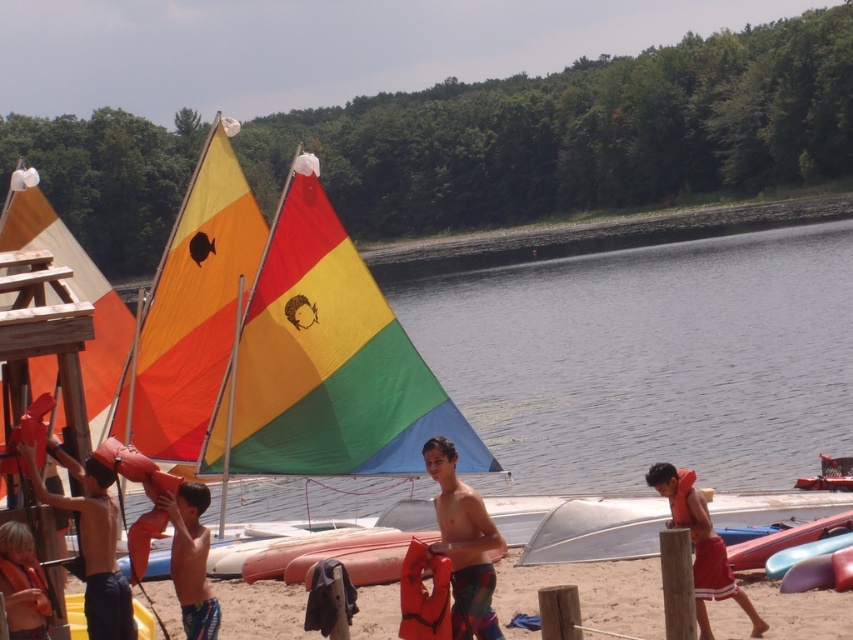
You are a camp counselor and need to ensure all children have properly sized life jackets. You notice two orange life jackets in the scene. The orange life vest at center is worn by a child, and the orange life jacket at lower left is on the dock. Which one is larger?

The orange life vest at center is bigger than the orange life jacket at lower left, so the orange life vest at center is larger.

You are a camp counselor who needs to ensure safety equipment is within easy reach. The orange life vest at left and orange life jacket at lower left are both on the dock. If the minimum safe distance between two life preservers is 36 inches, is the current placement compliant with safety regulations?

The distance between the orange life vest at left and orange life jacket at lower left is 34.37 inches, which is less than the required 36 inches. Therefore, the current placement does not comply with safety regulations.